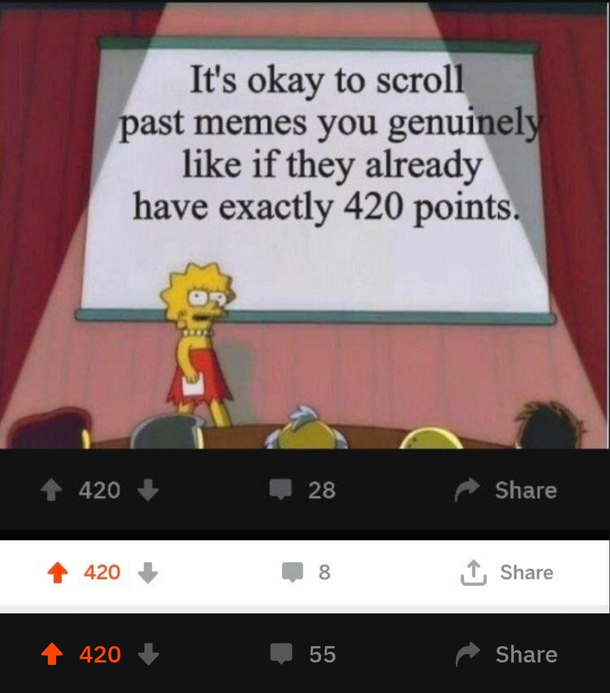
Identify the location of animated projection screen. Image resolution: width=610 pixels, height=693 pixels. (113, 312), (437, 272), (493, 188), (285, 157), (198, 166), (120, 161), (127, 59), (310, 60), (443, 43).